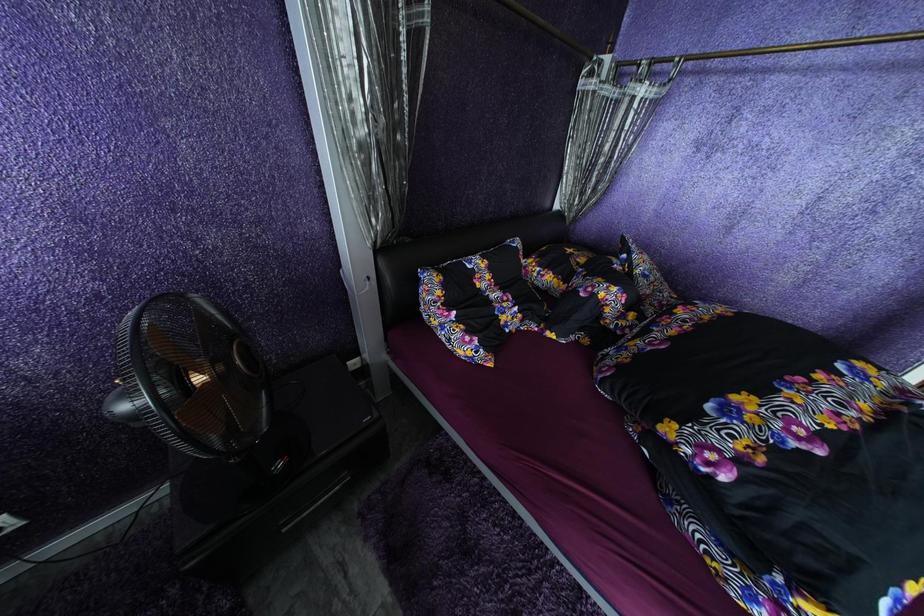
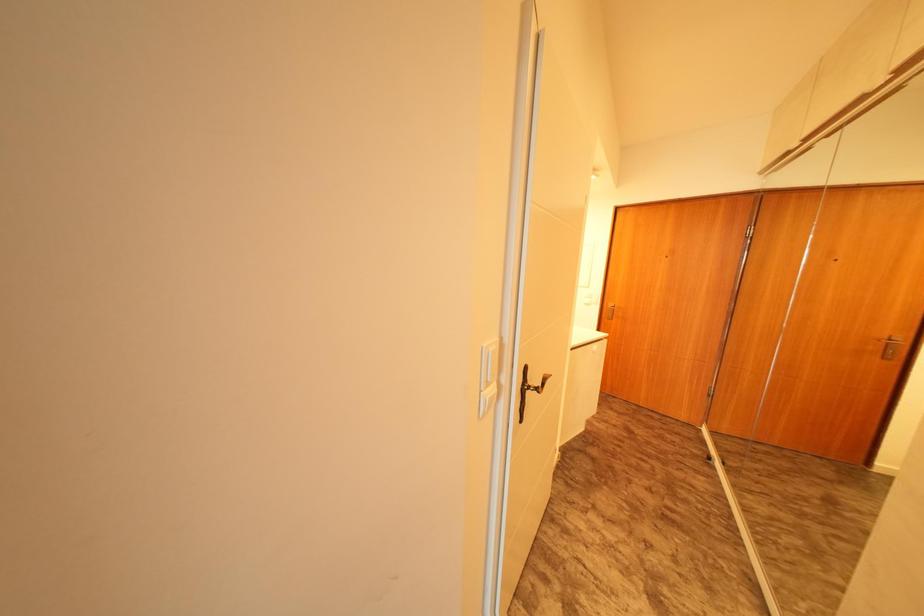
Question: What movement of the cameraman would produce the second image?

Choices:
 (A) Left
 (B) Right
 (C) Forward
 (D) Backward

Answer: (B)